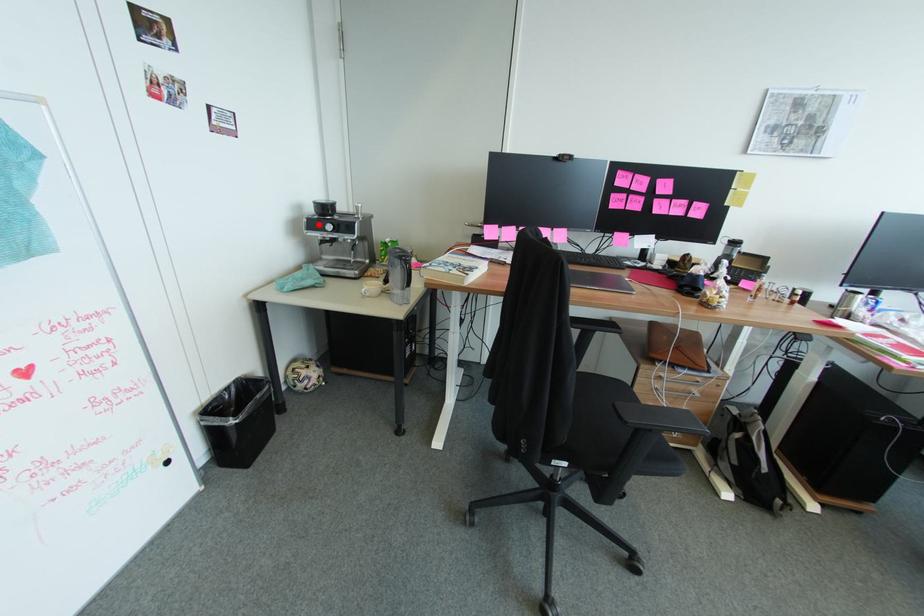
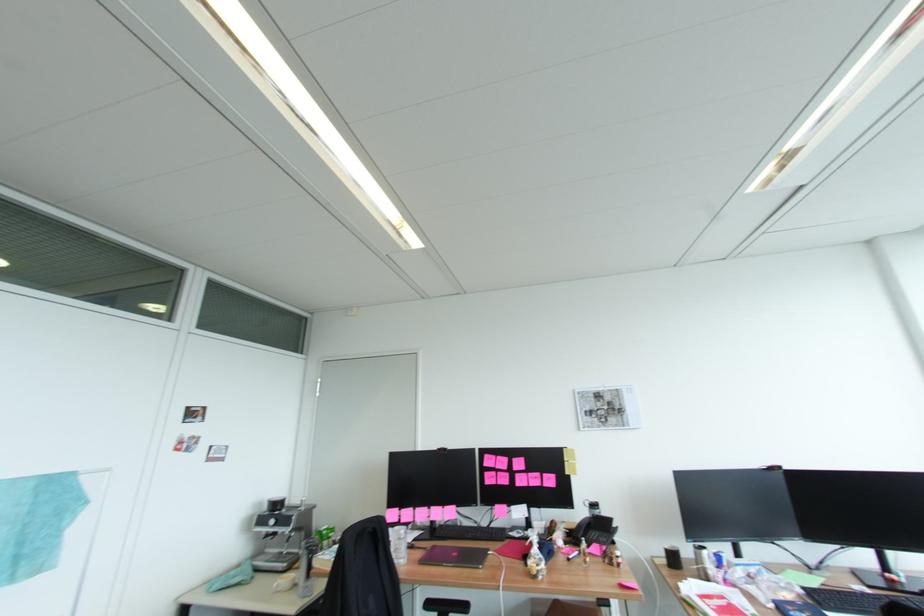
Question: I am providing you with two images of the same scene from different viewpoints. Given a red point in image1, look at the same physical point in image2. Is it:

Choices:
 (A) Closer to the viewpoint
 (B) Farther from the viewpoint

Answer: (B)